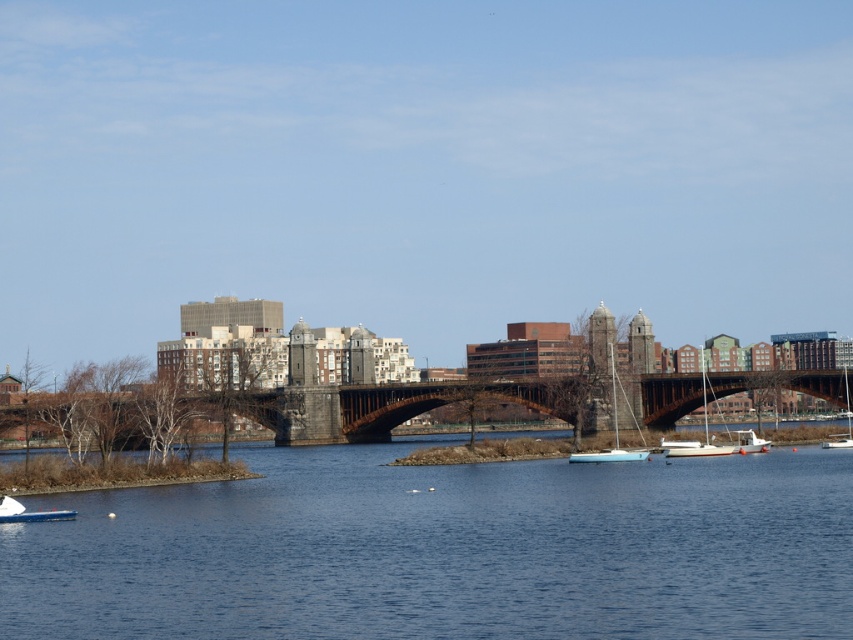
Can you confirm if blue water at center is taller than blue glossy boat at lower left?

Yes.

Who is more forward, (399, 529) or (44, 516)?

Point (399, 529)

Who is more distant from viewer, (820,490) or (21,506)?

The point (820,490) is more distant.

At what (x,y) coordinates should I click in order to perform the action: click on blue water at center. Please return your answer as a coordinate pair (x, y). The height and width of the screenshot is (640, 853). Looking at the image, I should click on (445, 550).

Does dark brown stone bridge at center have a lesser height compared to white glossy sailboat at lower right?

No.

Between dark brown stone bridge at center and white glossy sailboat at lower right, which one is positioned lower?

dark brown stone bridge at center is lower down.

Which is behind, point (692, 384) or point (833, 445)?

Positioned behind is point (692, 384).

At what (x,y) coordinates should I click in order to perform the action: click on dark brown stone bridge at center. Please return your answer as a coordinate pair (x, y). The height and width of the screenshot is (640, 853). Looking at the image, I should click on (383, 406).

Does white glossy boat at center have a greater height compared to white matte boat at lower right?

No, white glossy boat at center is not taller than white matte boat at lower right.

Who is more forward, (589, 452) or (756, 440)?

Point (589, 452) is more forward.

Between point (593, 452) and point (759, 444), which one is positioned in front?

Point (593, 452) is more forward.

Identify the location of white glossy boat at center. Image resolution: width=853 pixels, height=640 pixels. click(608, 456).